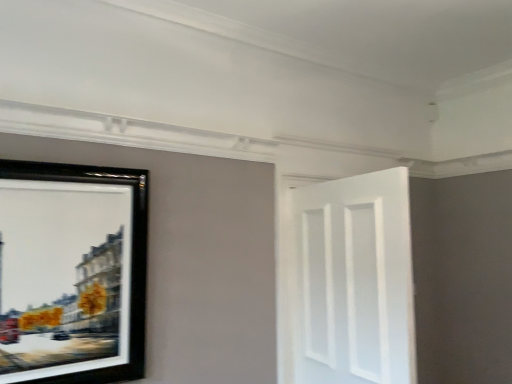
Question: Is white matte door at right further to camera compared to black matte picture frame at left?

Choices:
 (A) no
 (B) yes

Answer: (B)

Question: From a real-world perspective, is white matte door at right located beneath black matte picture frame at left?

Choices:
 (A) yes
 (B) no

Answer: (A)

Question: Is white matte door at right oriented away from black matte picture frame at left?

Choices:
 (A) yes
 (B) no

Answer: (A)

Question: Is white matte door at right touching black matte picture frame at left?

Choices:
 (A) no
 (B) yes

Answer: (A)

Question: Is white matte door at right shorter than black matte picture frame at left?

Choices:
 (A) yes
 (B) no

Answer: (B)

Question: Does white matte door at right have a greater width compared to black matte picture frame at left?

Choices:
 (A) yes
 (B) no

Answer: (A)

Question: Is black matte picture frame at left taller than white matte door at right?

Choices:
 (A) yes
 (B) no

Answer: (B)

Question: Is the depth of black matte picture frame at left less than that of white matte door at right?

Choices:
 (A) yes
 (B) no

Answer: (A)

Question: Is black matte picture frame at left completely or partially outside of white matte door at right?

Choices:
 (A) yes
 (B) no

Answer: (A)

Question: Is black matte picture frame at left beside white matte door at right?

Choices:
 (A) yes
 (B) no

Answer: (B)

Question: Considering the relative sizes of black matte picture frame at left and white matte door at right in the image provided, is black matte picture frame at left smaller than white matte door at right?

Choices:
 (A) yes
 (B) no

Answer: (A)

Question: Is black matte picture frame at left far away from white matte door at right?

Choices:
 (A) no
 (B) yes

Answer: (B)

Question: In terms of width, does white matte door at right look wider or thinner when compared to black matte picture frame at left?

Choices:
 (A) wide
 (B) thin

Answer: (A)